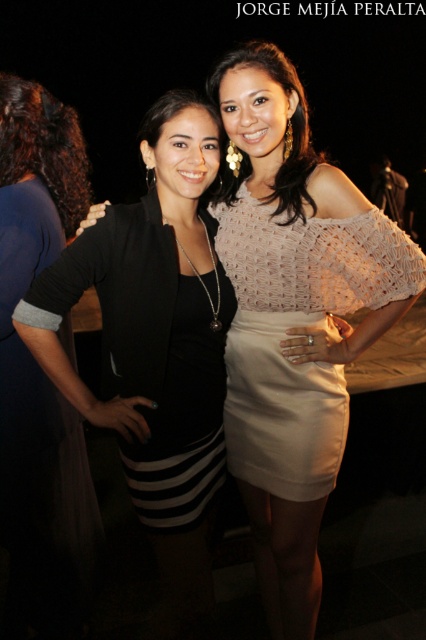
Question: Which is farther from the black matte dress at left?

Choices:
 (A) dark brown curly hair at left
 (B) white crochet dress at center

Answer: (B)

Question: Is white crochet dress at center further to camera compared to dark brown curly hair at left?

Choices:
 (A) no
 (B) yes

Answer: (A)

Question: Which of the following is the closest to the observer?

Choices:
 (A) black matte dress at left
 (B) dark brown curly hair at left

Answer: (A)

Question: Does black matte dress at left have a greater width compared to dark brown curly hair at left?

Choices:
 (A) yes
 (B) no

Answer: (B)

Question: Observing the image, what is the correct spatial positioning of white crochet dress at center in reference to dark brown curly hair at left?

Choices:
 (A) left
 (B) right

Answer: (B)

Question: Considering the real-world distances, which object is closest to the black matte dress at left?

Choices:
 (A) white crochet dress at center
 (B) dark brown curly hair at left

Answer: (B)